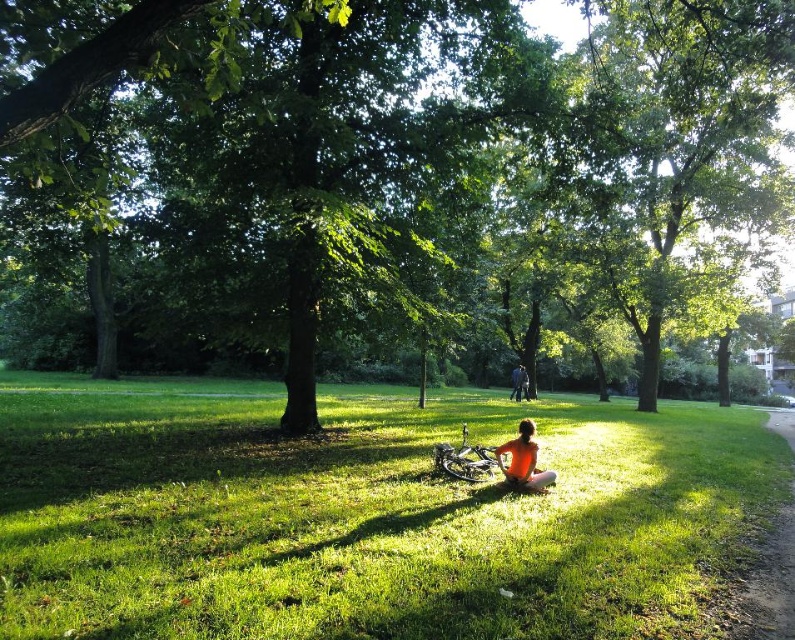
Question: Which object is the farthest from the dark blue jeans at center?

Choices:
 (A) orange fabric person at center
 (B) green leafy tree at center
 (C) green grassy at center

Answer: (A)

Question: Does green leafy tree at center appear on the left side of dark blue jeans at center?

Choices:
 (A) no
 (B) yes

Answer: (B)

Question: Can you confirm if green leafy tree at center is positioned to the left of dark blue jeans at center?

Choices:
 (A) no
 (B) yes

Answer: (B)

Question: Which object is farther from the camera taking this photo?

Choices:
 (A) dark blue jeans at center
 (B) green grassy at center

Answer: (A)

Question: Which point is farther to the camera?

Choices:
 (A) orange fabric person at center
 (B) dark blue jeans at center
 (C) green leafy tree at center

Answer: (B)

Question: Does green leafy tree at center come behind dark blue jeans at center?

Choices:
 (A) no
 (B) yes

Answer: (A)